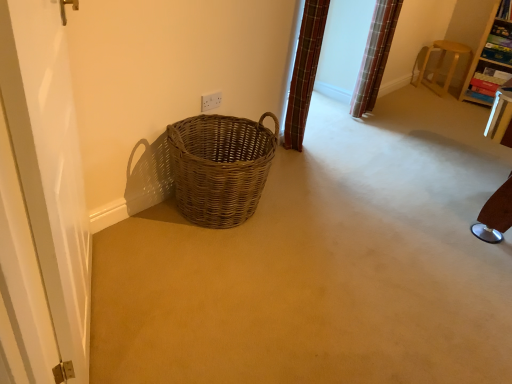
Question: Can you confirm if white glossy screen door at left is taller than wooden bookshelf at upper right, which is the second furniture in left-to-right order?

Choices:
 (A) no
 (B) yes

Answer: (B)

Question: Considering the relative sizes of white glossy screen door at left and wooden bookshelf at upper right, acting as the 1th furniture starting from the right, in the image provided, is white glossy screen door at left bigger than wooden bookshelf at upper right, acting as the 1th furniture starting from the right,?

Choices:
 (A) yes
 (B) no

Answer: (B)

Question: Can you confirm if white glossy screen door at left is smaller than wooden bookshelf at upper right, which is the second furniture in left-to-right order?

Choices:
 (A) yes
 (B) no

Answer: (A)

Question: Is white glossy screen door at left closer to the viewer compared to wooden bookshelf at upper right, acting as the 1th furniture starting from the right?

Choices:
 (A) no
 (B) yes

Answer: (B)

Question: Is white glossy screen door at left to the left of wooden bookshelf at upper right, which is the second furniture in left-to-right order, from the viewer's perspective?

Choices:
 (A) no
 (B) yes

Answer: (B)

Question: Is woven brown basket at center wider or thinner than wooden bookshelf at upper right?

Choices:
 (A) thin
 (B) wide

Answer: (B)

Question: Choose the correct answer: Is woven brown basket at center inside wooden bookshelf at upper right or outside it?

Choices:
 (A) outside
 (B) inside

Answer: (A)

Question: From a real-world perspective, is woven brown basket at center above or below wooden bookshelf at upper right?

Choices:
 (A) above
 (B) below

Answer: (B)

Question: Based on their positions, is woven brown basket at center located to the left or right of wooden bookshelf at upper right?

Choices:
 (A) right
 (B) left

Answer: (B)

Question: Is wooden bookshelf at upper right, acting as the 1th furniture starting from the right, to the left or to the right of wooden bookshelf at upper right in the image?

Choices:
 (A) right
 (B) left

Answer: (A)

Question: Does point (479, 69) appear closer or farther from the camera than point (505, 1)?

Choices:
 (A) farther
 (B) closer

Answer: (A)

Question: Considering the positions of wooden bookshelf at upper right, which is the second furniture in left-to-right order, and wooden bookshelf at upper right in the image, is wooden bookshelf at upper right, which is the second furniture in left-to-right order, taller or shorter than wooden bookshelf at upper right?

Choices:
 (A) tall
 (B) short

Answer: (A)

Question: Looking at the image, does wooden bookshelf at upper right, acting as the 1th furniture starting from the right, seem bigger or smaller compared to wooden bookshelf at upper right?

Choices:
 (A) big
 (B) small

Answer: (A)

Question: Is light brown wooden stool at upper right, which is counted as the 2th furniture, starting from the right, inside or outside of wooden bookshelf at upper right, acting as the 1th furniture starting from the right?

Choices:
 (A) inside
 (B) outside

Answer: (B)

Question: Is point (x=421, y=61) closer or farther from the camera than point (x=500, y=61)?

Choices:
 (A) farther
 (B) closer

Answer: (A)